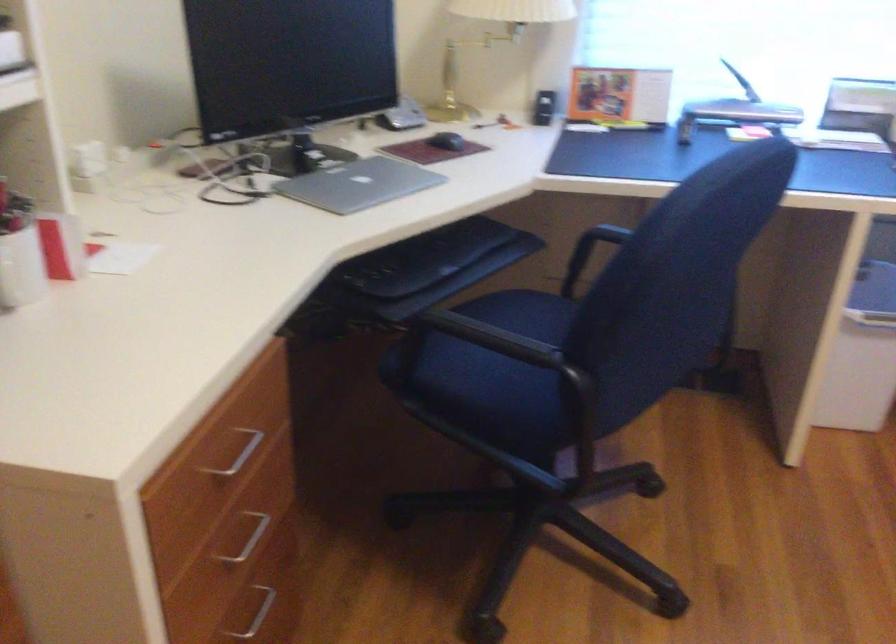
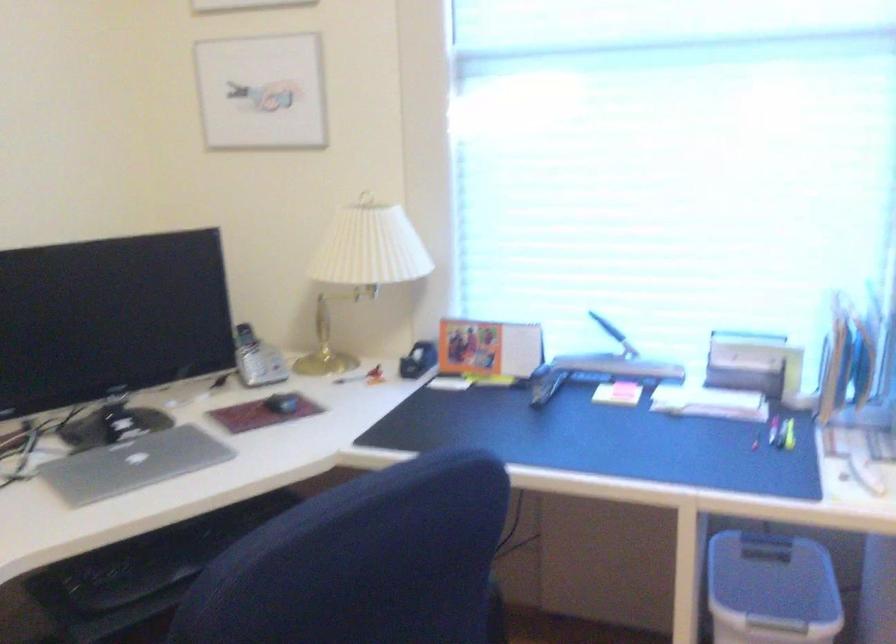
Find the pixel in the second image that matches pixel 453 138 in the first image.

(281, 402)